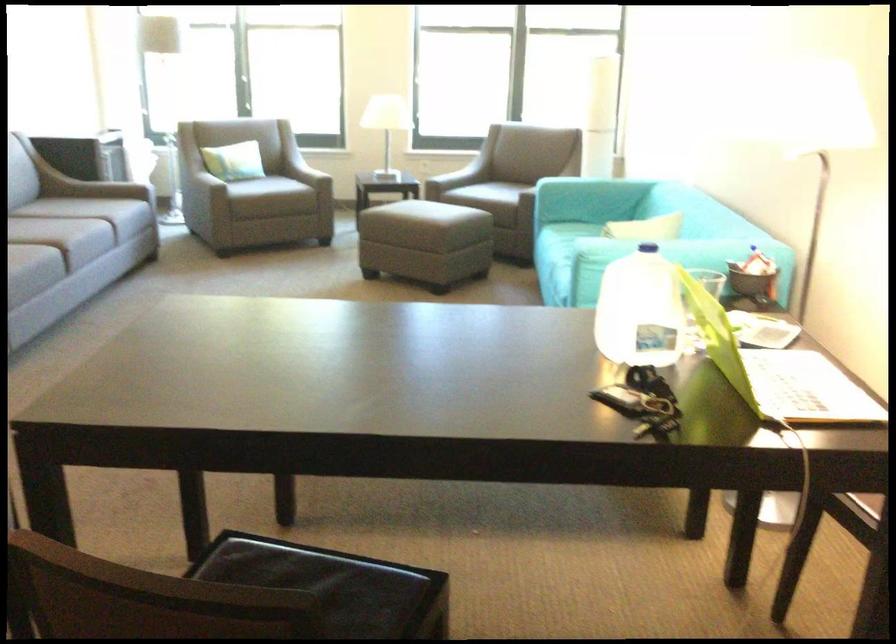
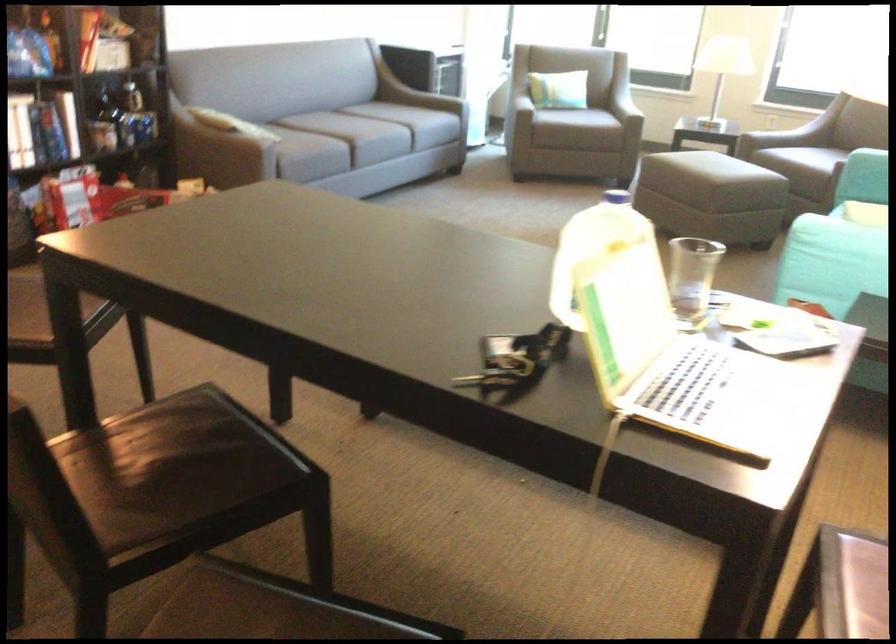
The images are taken continuously from a first-person perspective. In which direction is your viewpoint rotating?

The camera's rotation is toward right-down.